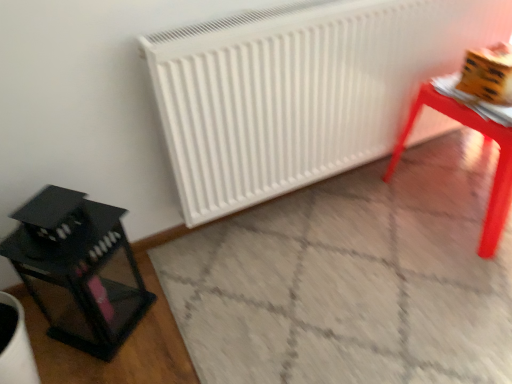
Locate an element on the screen. black glass lantern at left is located at coordinates (78, 269).

The width and height of the screenshot is (512, 384). Find the location of `smooth glossy table at right`. smooth glossy table at right is located at coordinates (485, 137).

From the image's perspective, which object appears higher, black glass lantern at left or white matte radiator at center?

white matte radiator at center.

I want to click on radiator that appears on the right of black glass lantern at left, so click(300, 90).

Would you say black glass lantern at left is a long distance from white matte radiator at center?

No.

From their relative heights in the image, would you say black glass lantern at left is taller or shorter than white matte radiator at center?

In the image, black glass lantern at left appears to be shorter than white matte radiator at center.

Is point (38, 226) closer to viewer compared to point (503, 135)?

That is True.

Is black glass lantern at left wider than smooth glossy table at right?

No.

Who is bigger, black glass lantern at left or smooth glossy table at right?

Bigger between the two is smooth glossy table at right.

Is there a large distance between black glass lantern at left and smooth glossy table at right?

Yes, black glass lantern at left and smooth glossy table at right are quite far apart.

You are a GUI agent. You are given a task and a screenshot of the screen. Output one action in this format:
    pyautogui.click(x=<x>, y=<y>)
    Task: Click on the table directly beneath the white matte radiator at center (from a real-world perspective)
    This screenshot has height=384, width=512.
    Given the screenshot: What is the action you would take?
    pyautogui.click(x=485, y=137)

Which is more to the right, smooth glossy table at right or white matte radiator at center?

From the viewer's perspective, smooth glossy table at right appears more on the right side.

How much distance is there between smooth glossy table at right and white matte radiator at center?

A distance of 16.19 inches exists between smooth glossy table at right and white matte radiator at center.

Does point (466, 114) come in front of point (310, 115)?

Yes, it is in front of point (310, 115).

Can you confirm if white matte radiator at center is taller than black glass lantern at left?

Indeed, white matte radiator at center has a greater height compared to black glass lantern at left.

Considering the positions of points (253, 109) and (129, 273), is point (253, 109) closer to camera compared to point (129, 273)?

Yes.

How much distance is there between white matte radiator at center and black glass lantern at left?

The distance of white matte radiator at center from black glass lantern at left is 23.03 inches.

Is white matte radiator at center inside or outside of black glass lantern at left?

white matte radiator at center exists outside the volume of black glass lantern at left.

How distant is smooth glossy table at right from black glass lantern at left?

They are 1.17 meters apart.

Is point (430, 99) farther from camera compared to point (92, 327)?

Yes, it is.

Which object is further away from the camera, smooth glossy table at right or black glass lantern at left?

smooth glossy table at right.

Is smooth glossy table at right aimed at black glass lantern at left?

No, smooth glossy table at right is not facing towards black glass lantern at left.

Find the location of a particular element. This screenshot has height=384, width=512. table that appears on the right of white matte radiator at center is located at coordinates (485, 137).

Is white matte radiator at center to the right of smooth glossy table at right from the viewer's perspective?

No, white matte radiator at center is not to the right of smooth glossy table at right.

How many degrees apart are the facing directions of white matte radiator at center and smooth glossy table at right?

The angular difference between white matte radiator at center and smooth glossy table at right is 0.223 degrees.

Considering the relative positions of white matte radiator at center and smooth glossy table at right in the image provided, is white matte radiator at center in front of smooth glossy table at right?

Yes, white matte radiator at center is closer to the camera.

Image resolution: width=512 pixels, height=384 pixels. Identify the location of radiator lying above the black glass lantern at left (from the image's perspective). (300, 90).

The image size is (512, 384). Identify the location of furniture that appears below the smooth glossy table at right (from the image's perspective). (78, 269).

Looking at this image, based on their spatial positions, is white matte radiator at center or smooth glossy table at right closer to black glass lantern at left?

white matte radiator at center lies closer to black glass lantern at left than the other object.

When comparing their distances from smooth glossy table at right, does white matte radiator at center or black glass lantern at left seem closer?

white matte radiator at center is closer to smooth glossy table at right.

Estimate the real-world distances between objects in this image. Which object is further from black glass lantern at left, smooth glossy table at right or white matte radiator at center?

smooth glossy table at right is further to black glass lantern at left.

From the image, which object appears to be farther from white matte radiator at center, black glass lantern at left or smooth glossy table at right?

black glass lantern at left lies further to white matte radiator at center than the other object.

Estimate the real-world distances between objects in this image. Which object is closer to smooth glossy table at right, black glass lantern at left or white matte radiator at center?

Based on the image, white matte radiator at center appears to be nearer to smooth glossy table at right.

Based on their spatial positions, is smooth glossy table at right or black glass lantern at left closer to white matte radiator at center?

smooth glossy table at right lies closer to white matte radiator at center than the other object.

The width and height of the screenshot is (512, 384). What are the coordinates of `radiator between black glass lantern at left and smooth glossy table at right from left to right` in the screenshot? It's located at (300, 90).